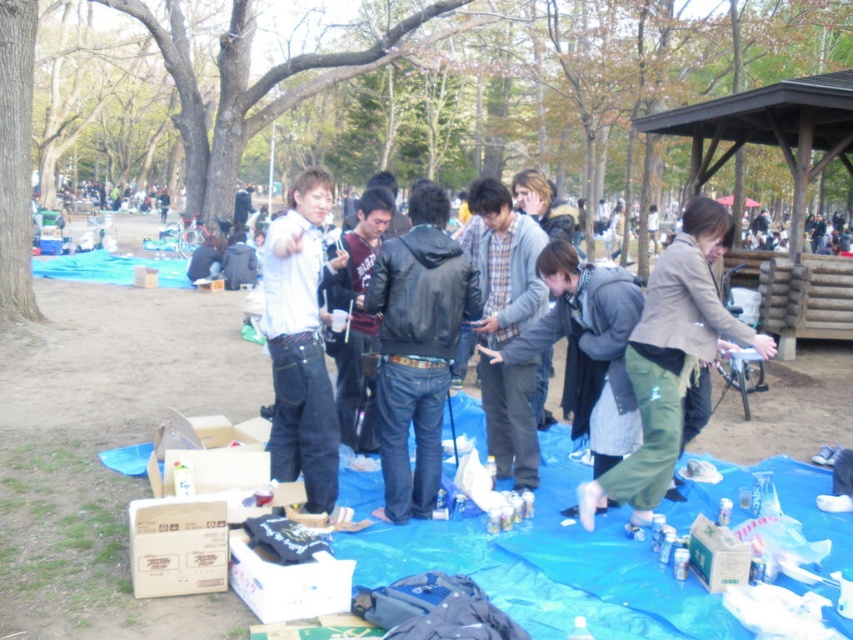
You are a person who wants to place a new item on the blue tarp in the park. You have a matte brown jacket that you want to place at the center of the tarp. However, there is already an object at point (670, 360). What object is currently occupying that spot?

The point (670, 360) on the blue tarp has a matte brown jacket at center located there.

You are standing at the edge of the blue tarp and want to place a new item exactly at the center of the tarp. The black leather jacket at center is currently occupying the center point. Can you determine if the jacket is exactly at the center of the tarp based on its coordinates?

The black leather jacket at center is located at coordinates point (416, 348), which are very close to the center point of the tarp. Since the coordinates are nearly 0.5 in both x and y axes, it can be considered that the jacket is approximately at the center of the tarp.